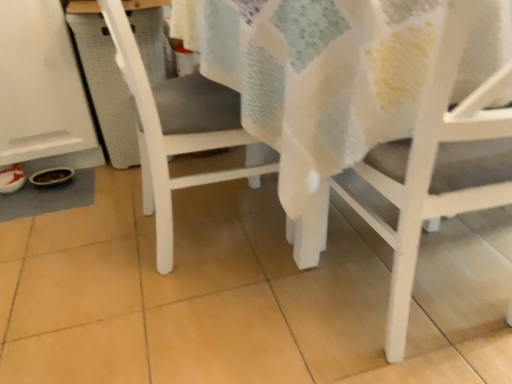
Question: Does point (436, 198) appear closer or farther from the camera than point (128, 26)?

Choices:
 (A) closer
 (B) farther

Answer: (A)

Question: From a real-world perspective, relative to white matte chair at center, which ranks as the 1th chair in left-to-right order, is white matte chair at lower right, the 1th chair viewed from the right, vertically above or below?

Choices:
 (A) above
 (B) below

Answer: (A)

Question: From the image's perspective, is white matte chair at lower right, arranged as the second chair when viewed from the left, above or below white matte chair at center, arranged as the second chair when viewed from the right?

Choices:
 (A) above
 (B) below

Answer: (B)

Question: From a real-world perspective, is white matte chair at center, which ranks as the 1th chair in left-to-right order, positioned above or below white matte chair at lower right, arranged as the second chair when viewed from the left?

Choices:
 (A) above
 (B) below

Answer: (B)

Question: Which is correct: white matte chair at center, which ranks as the 1th chair in left-to-right order, is inside white matte chair at lower right, the 1th chair viewed from the right, or outside of it?

Choices:
 (A) inside
 (B) outside

Answer: (B)

Question: In terms of height, does white matte chair at center, arranged as the second chair when viewed from the right, look taller or shorter compared to white matte chair at lower right, arranged as the second chair when viewed from the left?

Choices:
 (A) tall
 (B) short

Answer: (B)

Question: Is point (219, 134) closer or farther from the camera than point (373, 175)?

Choices:
 (A) closer
 (B) farther

Answer: (B)